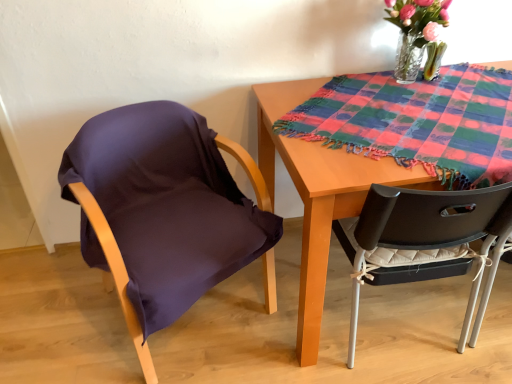
What is the approximate width of purple fabric chair at left?

It is 24.02 inches.

Describe the element at coordinates (417, 122) in the screenshot. I see `multicolored woven cloth at upper right` at that location.

What do you see at coordinates (415, 31) in the screenshot? The height and width of the screenshot is (384, 512). I see `translucent glass vase at upper right` at bounding box center [415, 31].

At what (x,y) coordinates should I click in order to perform the action: click on purple fabric chair at left. Please return your answer as a coordinate pair (x, y). This screenshot has height=384, width=512. Looking at the image, I should click on (164, 211).

Which is correct: wooden table at center is inside purple fabric chair at left, or outside of it?

wooden table at center exists outside the volume of purple fabric chair at left.

Considering the sizes of wooden table at center and purple fabric chair at left in the image, is wooden table at center bigger or smaller than purple fabric chair at left?

Clearly, wooden table at center is smaller in size than purple fabric chair at left.

Which object is wider, wooden table at center or purple fabric chair at left?

Wider between the two is purple fabric chair at left.

From a real-world perspective, between wooden table at center and purple fabric chair at left, who is vertically lower?

In real-world perspective, wooden table at center is lower.

Can you confirm if purple fabric chair at left is wider than translucent glass vase at upper right?

Correct, the width of purple fabric chair at left exceeds that of translucent glass vase at upper right.

From the image's perspective, relative to translucent glass vase at upper right, is purple fabric chair at left above or below?

purple fabric chair at left is situated lower than translucent glass vase at upper right in the image.

The height and width of the screenshot is (384, 512). I want to click on floral arrangement on the right side of purple fabric chair at left, so click(415, 31).

Can you confirm if translucent glass vase at upper right is wider than multicolored woven cloth at upper right?

No, translucent glass vase at upper right is not wider than multicolored woven cloth at upper right.

Considering the sizes of objects translucent glass vase at upper right and multicolored woven cloth at upper right in the image provided, who is shorter, translucent glass vase at upper right or multicolored woven cloth at upper right?

multicolored woven cloth at upper right.

Is point (404, 63) farther from viewer compared to point (500, 165)?

That is True.

Which is behind, translucent glass vase at upper right or multicolored woven cloth at upper right?

translucent glass vase at upper right is more distant.

From a real-world perspective, is translucent glass vase at upper right physically located above or below wooden table at center?

Clearly, from a real-world perspective, translucent glass vase at upper right is above wooden table at center.

Can you confirm if translucent glass vase at upper right is taller than wooden table at center?

Incorrect, the height of translucent glass vase at upper right is not larger of that of wooden table at center.

Which of these two, translucent glass vase at upper right or wooden table at center, is bigger?

With larger size is wooden table at center.

Does point (280, 150) appear closer or farther from the camera than point (327, 137)?

Point (280, 150) is closer to the camera than point (327, 137).

Which is behind, wooden table at center or multicolored woven cloth at upper right?

multicolored woven cloth at upper right is behind.

Is multicolored woven cloth at upper right surrounded by wooden table at center?

No, wooden table at center does not contain multicolored woven cloth at upper right.

Can you tell me how much wooden table at center and multicolored woven cloth at upper right differ in facing direction?

139 degrees.

Does multicolored woven cloth at upper right appear on the right side of purple fabric chair at left?

Yes.

Is multicolored woven cloth at upper right further to camera compared to purple fabric chair at left?

Yes, multicolored woven cloth at upper right is further from the camera.

Is purple fabric chair at left at the back of multicolored woven cloth at upper right?

No.

Identify the location of blanket that is behind the purple fabric chair at left. (417, 122).

From the image's perspective, between purple fabric chair at left and wooden table at center, which one is located above?

purple fabric chair at left.

From a real-world perspective, is purple fabric chair at left above or below wooden table at center?

purple fabric chair at left is above wooden table at center.

Would you say purple fabric chair at left is inside or outside wooden table at center?

purple fabric chair at left is outside wooden table at center.

Is purple fabric chair at left closer to camera compared to wooden table at center?

Yes, the depth of purple fabric chair at left is less than that of wooden table at center.

The image size is (512, 384). I want to click on table beneath the purple fabric chair at left (from a real-world perspective), so click(x=319, y=194).

I want to click on chair on the left of translucent glass vase at upper right, so click(164, 211).

Considering their positions, is wooden table at center positioned further to purple fabric chair at left than multicolored woven cloth at upper right?

Among the two, multicolored woven cloth at upper right is located further to purple fabric chair at left.

Looking at the image, which one is located further to translucent glass vase at upper right, purple fabric chair at left or wooden table at center?

purple fabric chair at left lies further to translucent glass vase at upper right than the other object.

From the picture: Looking at the image, which one is located closer to multicolored woven cloth at upper right, translucent glass vase at upper right or wooden table at center?

wooden table at center is closer to multicolored woven cloth at upper right.

Considering their positions, is multicolored woven cloth at upper right positioned closer to wooden table at center than purple fabric chair at left?

multicolored woven cloth at upper right is positioned closer to the anchor wooden table at center.

Based on their spatial positions, is wooden table at center or translucent glass vase at upper right closer to purple fabric chair at left?

Among the two, wooden table at center is located nearer to purple fabric chair at left.

Considering their positions, is purple fabric chair at left positioned further to wooden table at center than translucent glass vase at upper right?

translucent glass vase at upper right.

Considering their positions, is translucent glass vase at upper right positioned further to wooden table at center than purple fabric chair at left?

translucent glass vase at upper right is positioned further to the anchor wooden table at center.

In the scene shown: Based on their spatial positions, is purple fabric chair at left or translucent glass vase at upper right further from multicolored woven cloth at upper right?

purple fabric chair at left is positioned further to the anchor multicolored woven cloth at upper right.

Identify the location of floral arrangement located between purple fabric chair at left and multicolored woven cloth at upper right in the left-right direction. The image size is (512, 384). (415, 31).

The height and width of the screenshot is (384, 512). I want to click on blanket that lies between translucent glass vase at upper right and wooden table at center from top to bottom, so click(x=417, y=122).

Where is `table situated between purple fabric chair at left and multicolored woven cloth at upper right from left to right`? Image resolution: width=512 pixels, height=384 pixels. table situated between purple fabric chair at left and multicolored woven cloth at upper right from left to right is located at coordinates click(319, 194).

Where is `table between purple fabric chair at left and translucent glass vase at upper right`? table between purple fabric chair at left and translucent glass vase at upper right is located at coordinates (319, 194).